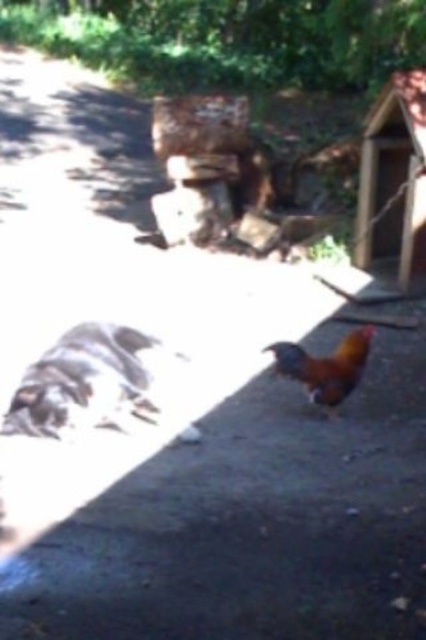
The image size is (426, 640). Identify the location of brown feathered chicken at center. (85, 381).

Who is positioned more to the left, brown feathered chicken at center or rusty metallic rooster at center?

brown feathered chicken at center

This screenshot has width=426, height=640. Describe the element at coordinates (85, 381) in the screenshot. I see `brown feathered chicken at center` at that location.

Where is `brown feathered chicken at center`? This screenshot has width=426, height=640. brown feathered chicken at center is located at coordinates (85, 381).